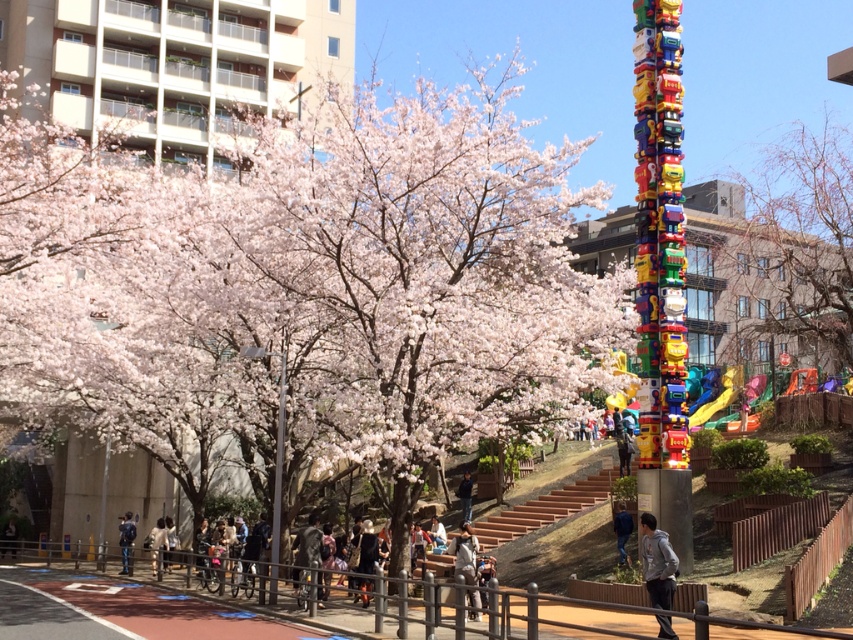
You are standing on the paved red path in the urban scene and want to greet both the person wearing the gray hoodie at lower right and the person in the light blue denim jacket at lower center. Which person should you approach first to reach them more quickly?

You should approach the gray hoodie at lower right first because it is closer to you than the light blue denim jacket at lower center, so you can reach them more quickly.

You are standing at the point marked by the coordinates point (657, 563) in the image. What is the nearest object to you?

The point (657, 563) marks the gray hoodie at lower right, so the nearest object to you is the gray hoodie at lower right.